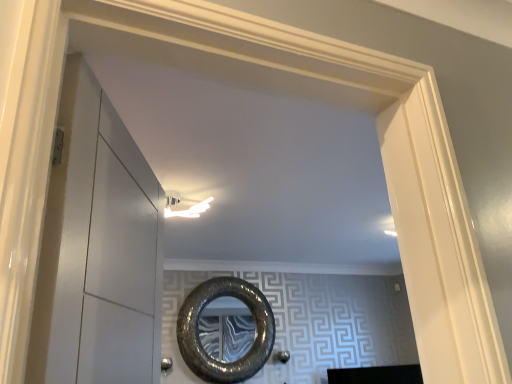
Question: Is polished silver door handle at lower center shorter than transparent glass door at left?

Choices:
 (A) yes
 (B) no

Answer: (A)

Question: Does polished silver door handle at lower center turn towards transparent glass door at left?

Choices:
 (A) yes
 (B) no

Answer: (B)

Question: Is polished silver door handle at lower center not close to transparent glass door at left?

Choices:
 (A) no
 (B) yes

Answer: (B)

Question: From the image's perspective, does polished silver door handle at lower center appear lower than transparent glass door at left?

Choices:
 (A) no
 (B) yes

Answer: (B)

Question: Considering the relative sizes of polished silver door handle at lower center and transparent glass door at left in the image provided, is polished silver door handle at lower center wider than transparent glass door at left?

Choices:
 (A) yes
 (B) no

Answer: (B)

Question: Looking at their shapes, would you say transparent glass door at left is wider or thinner than shiny metallic mirror at center?

Choices:
 (A) thin
 (B) wide

Answer: (B)

Question: Is transparent glass door at left to the left or to the right of shiny metallic mirror at center in the image?

Choices:
 (A) left
 (B) right

Answer: (A)

Question: Does point (47, 200) appear closer or farther from the camera than point (261, 337)?

Choices:
 (A) farther
 (B) closer

Answer: (B)

Question: Based on their sizes in the image, would you say transparent glass door at left is bigger or smaller than shiny metallic mirror at center?

Choices:
 (A) big
 (B) small

Answer: (B)

Question: In terms of size, does polished silver door handle at lower center appear bigger or smaller than shiny metallic mirror at center?

Choices:
 (A) small
 (B) big

Answer: (A)

Question: Relative to shiny metallic mirror at center, is polished silver door handle at lower center in front or behind?

Choices:
 (A) front
 (B) behind

Answer: (A)

Question: From a real-world perspective, is polished silver door handle at lower center above or below shiny metallic mirror at center?

Choices:
 (A) above
 (B) below

Answer: (B)

Question: From their relative heights in the image, would you say polished silver door handle at lower center is taller or shorter than shiny metallic mirror at center?

Choices:
 (A) short
 (B) tall

Answer: (A)

Question: Is polished silver door handle at lower center spatially inside transparent glass door at left, or outside of it?

Choices:
 (A) outside
 (B) inside

Answer: (A)

Question: Is polished silver door handle at lower center in front of or behind transparent glass door at left in the image?

Choices:
 (A) front
 (B) behind

Answer: (B)